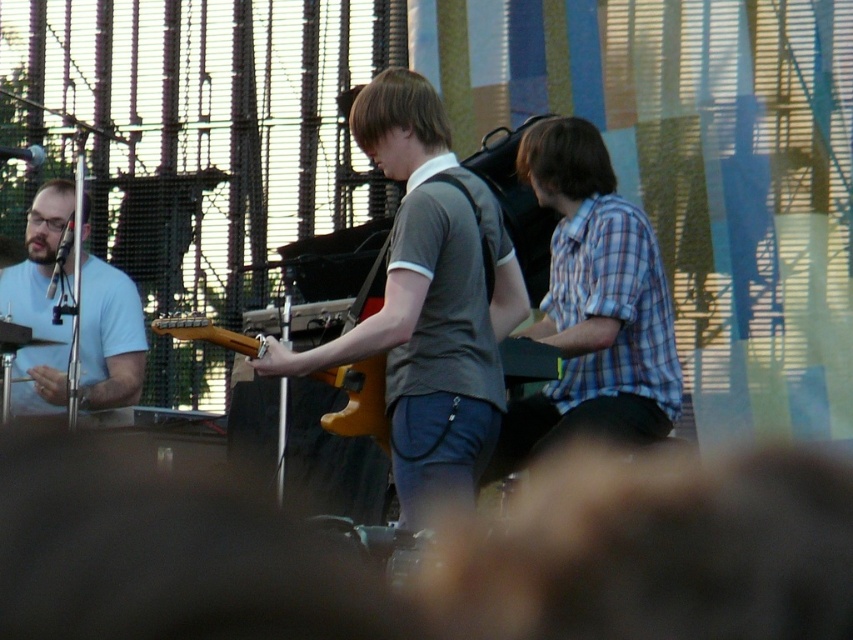
Question: Does matte gray shirt at center have a lesser width compared to blue plaid shirt at center?

Choices:
 (A) yes
 (B) no

Answer: (A)

Question: Which point appears farthest from the camera in this image?

Choices:
 (A) (230, 339)
 (B) (99, 406)

Answer: (B)

Question: Which point is closer to the camera?

Choices:
 (A) wooden electric guitar at center
 (B) matte gray shirt at center
 (C) light blue shirt at left
 (D) blue plaid shirt at center

Answer: (A)

Question: Is blue plaid shirt at center above light blue shirt at left?

Choices:
 (A) no
 (B) yes

Answer: (A)

Question: Which object is positioned farthest from the wooden electric guitar at center?

Choices:
 (A) blue plaid shirt at center
 (B) light blue shirt at left

Answer: (B)

Question: From the image, what is the correct spatial relationship of matte gray shirt at center in relation to blue plaid shirt at center?

Choices:
 (A) above
 (B) below

Answer: (B)